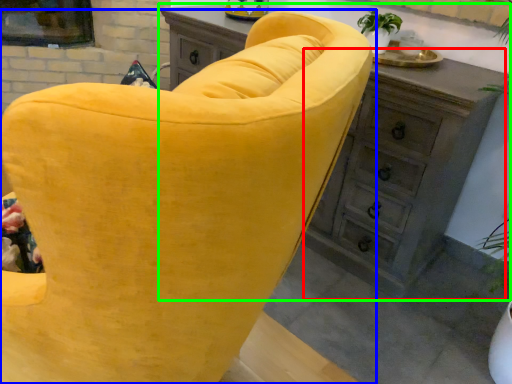
Question: Based on their relative distances, which object is nearer to dresser (highlighted by a red box)? Choose from chair (highlighted by a blue box) and chest of drawers (highlighted by a green box).

Choices:
 (A) chair
 (B) chest of drawers

Answer: (B)